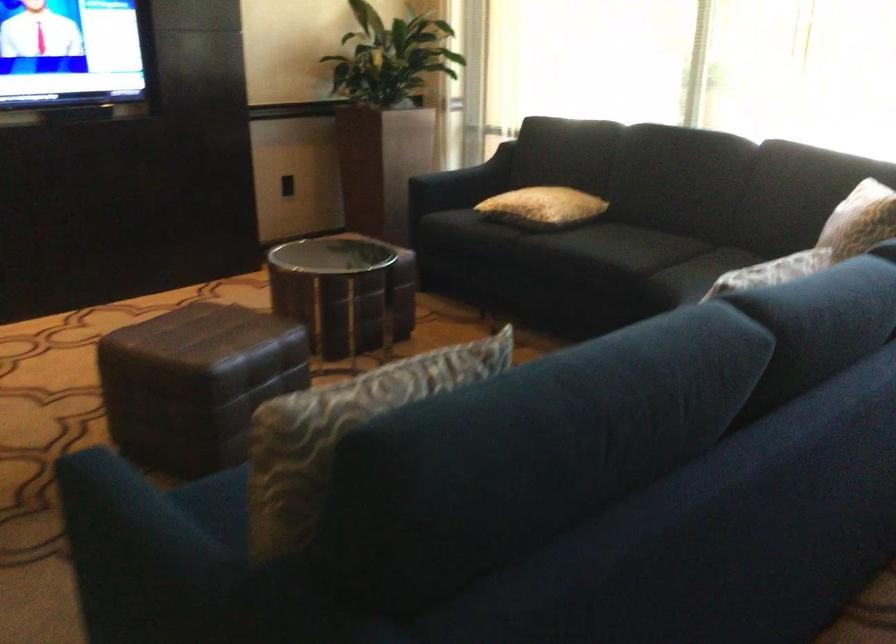
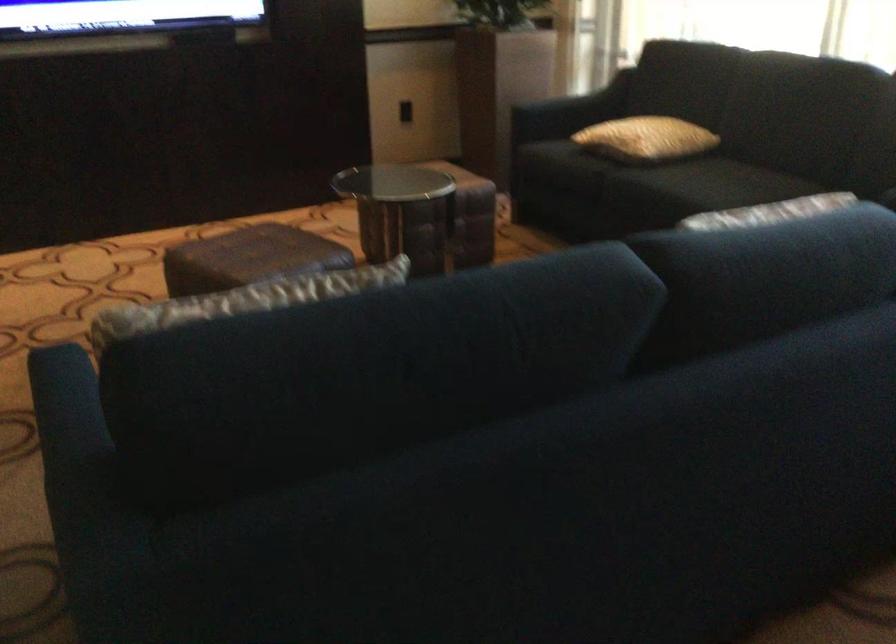
Question: Which direction would the cameraman need to move to produce the second image? Reply with the corresponding letter.

Choices:
 (A) Left
 (B) Right
 (C) Forward
 (D) Backward

Answer: (B)